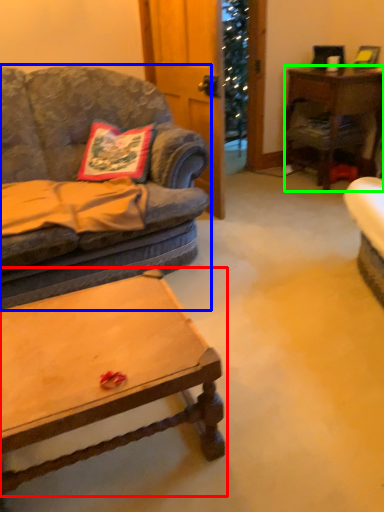
Question: Estimate the real-world distances between objects in this image. Which object is closer to coffee table (highlighted by a red box), studio couch (highlighted by a blue box) or desk (highlighted by a green box)?

Choices:
 (A) studio couch
 (B) desk

Answer: (A)